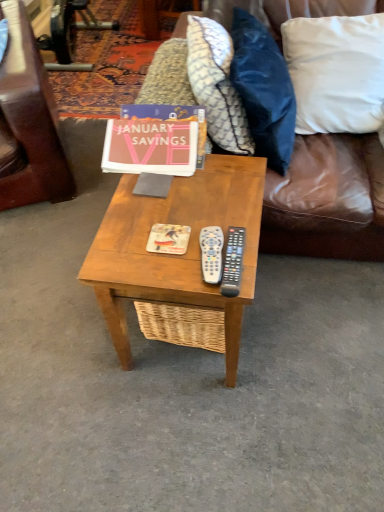
Locate an element on the screen. vacant area that is in front of matte orange magazine at center is located at coordinates (171, 268).